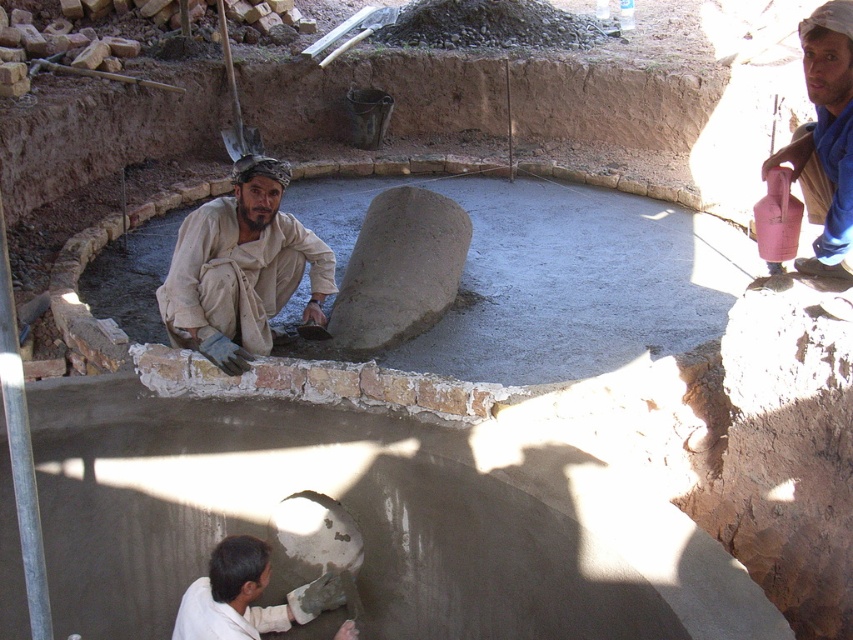
Question: Which object is closer to the camera taking this photo?

Choices:
 (A) blue fabric water can at upper right
 (B) beige fabric pants at lower left

Answer: (A)

Question: Is beige fabric pants at lower left wider than blue fabric water can at upper right?

Choices:
 (A) no
 (B) yes

Answer: (B)

Question: Which point appears closest to the camera in this image?

Choices:
 (A) (221, 557)
 (B) (839, 260)
 (C) (233, 352)

Answer: (A)

Question: Is beige fabric pants at lower left further to the viewer compared to white matte trowel at lower center?

Choices:
 (A) yes
 (B) no

Answer: (A)

Question: In this image, where is beige fabric pants at lower left located relative to white matte trowel at lower center?

Choices:
 (A) below
 (B) above

Answer: (B)

Question: Which object is closer to the camera taking this photo?

Choices:
 (A) white matte trowel at lower center
 (B) beige fabric pants at lower left
 (C) blue fabric water can at upper right

Answer: (A)